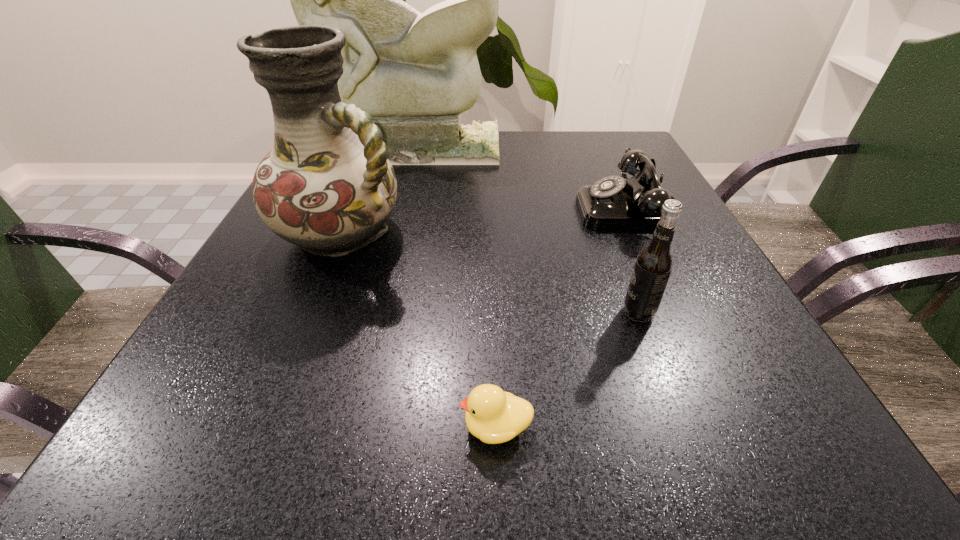
At what (x,y) coordinates should I click in order to perform the action: click on vacant area at the far right corner of the desktop. Please return your answer as a coordinate pair (x, y). This screenshot has height=540, width=960. Looking at the image, I should click on (612, 147).

At what (x,y) coordinates should I click in order to perform the action: click on free space between the vase and the root beer. Please return your answer as a coordinate pair (x, y). Image resolution: width=960 pixels, height=540 pixels. Looking at the image, I should click on (491, 272).

Find the location of a particular element. This screenshot has width=960, height=540. free space between the fourth farthest object and the farthest object is located at coordinates (525, 230).

Image resolution: width=960 pixels, height=540 pixels. I want to click on free spot between the shortest object and the telephone, so click(x=561, y=318).

Locate an element on the screen. The height and width of the screenshot is (540, 960). free space that is in between the shortest object and the telephone is located at coordinates (561, 318).

Where is `blank region between the second tallest object and the nearest object`? blank region between the second tallest object and the nearest object is located at coordinates (419, 329).

Where is `vacant space that's between the shortest object and the vase`? The image size is (960, 540). vacant space that's between the shortest object and the vase is located at coordinates (419, 329).

Locate an element on the screen. free space between the root beer and the sculpture is located at coordinates (525, 230).

Find the location of a particular element. vacant area that lies between the root beer and the shortest object is located at coordinates (567, 369).

In order to click on free space between the shortest object and the second nearest object in this screenshot , I will do `click(567, 369)`.